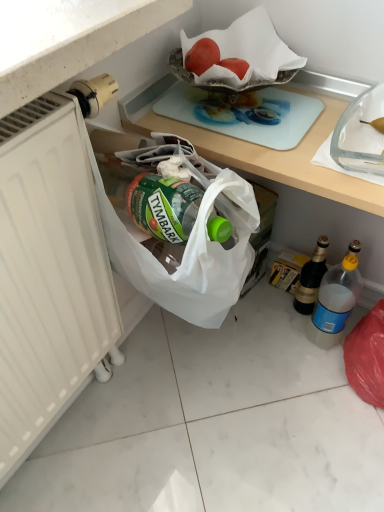
Question: From the image's perspective, would you say white matte radiator at left is shown under red matte tomato at upper center?

Choices:
 (A) no
 (B) yes

Answer: (B)

Question: Is white matte radiator at left to the right of red matte tomato at upper center from the viewer's perspective?

Choices:
 (A) yes
 (B) no

Answer: (B)

Question: From a real-world perspective, is white matte radiator at left positioned over red matte tomato at upper center based on gravity?

Choices:
 (A) no
 (B) yes

Answer: (A)

Question: Can you confirm if white matte radiator at left is shorter than red matte tomato at upper center?

Choices:
 (A) no
 (B) yes

Answer: (A)

Question: Considering the relative sizes of white matte radiator at left and red matte tomato at upper center in the image provided, is white matte radiator at left wider than red matte tomato at upper center?

Choices:
 (A) yes
 (B) no

Answer: (A)

Question: Considering the positions of point click(x=324, y=248) and point click(x=258, y=130), is point click(x=324, y=248) closer or farther from the camera than point click(x=258, y=130)?

Choices:
 (A) farther
 (B) closer

Answer: (A)

Question: Which is correct: dark brown glass bottle at lower right, which is the second bottle in front-to-back order, is inside light blue glass cutting board at upper center, or outside of it?

Choices:
 (A) inside
 (B) outside

Answer: (B)

Question: From a real-world perspective, is dark brown glass bottle at lower right, the first bottle positioned from the back, above or below light blue glass cutting board at upper center?

Choices:
 (A) above
 (B) below

Answer: (B)

Question: Is dark brown glass bottle at lower right, the first bottle positioned from the back, bigger or smaller than light blue glass cutting board at upper center?

Choices:
 (A) small
 (B) big

Answer: (B)

Question: From the image's perspective, relative to blue plastic bottle at lower right, the first bottle viewed from the front, is red matte tomato at upper center above or below?

Choices:
 (A) below
 (B) above

Answer: (B)

Question: Considering the positions of red matte tomato at upper center and blue plastic bottle at lower right, acting as the 2th bottle starting from the back, in the image, is red matte tomato at upper center bigger or smaller than blue plastic bottle at lower right, acting as the 2th bottle starting from the back,?

Choices:
 (A) small
 (B) big

Answer: (A)

Question: Based on their positions, is red matte tomato at upper center located to the left or right of blue plastic bottle at lower right, the first bottle viewed from the front?

Choices:
 (A) right
 (B) left

Answer: (B)

Question: Considering the positions of red matte tomato at upper center and blue plastic bottle at lower right, the first bottle viewed from the front, in the image, is red matte tomato at upper center taller or shorter than blue plastic bottle at lower right, the first bottle viewed from the front,?

Choices:
 (A) short
 (B) tall

Answer: (A)

Question: Based on their sizes in the image, would you say dark brown glass bottle at lower right, the first bottle positioned from the back, is bigger or smaller than white matte tile at lower left?

Choices:
 (A) small
 (B) big

Answer: (A)

Question: Is point (316, 296) closer or farther from the camera than point (130, 379)?

Choices:
 (A) farther
 (B) closer

Answer: (A)